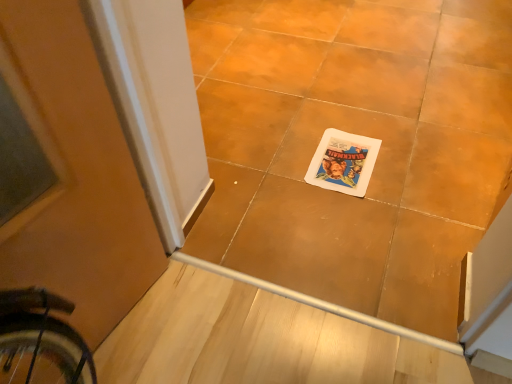
The width and height of the screenshot is (512, 384). What do you see at coordinates (343, 162) in the screenshot?
I see `white matte comic book at center` at bounding box center [343, 162].

Find the location of `white matte comic book at center`. white matte comic book at center is located at coordinates (343, 162).

Where is `white matte comic book at center`? The height and width of the screenshot is (384, 512). white matte comic book at center is located at coordinates (343, 162).